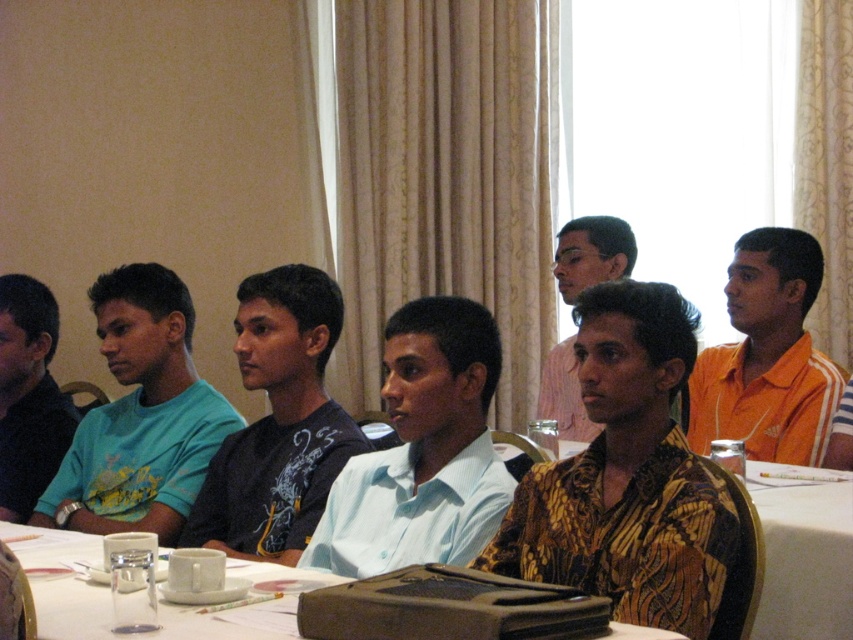
Can you confirm if printed fabric shirt at center is positioned above light blue shirt at center?

Incorrect, printed fabric shirt at center is not positioned above light blue shirt at center.

Does point (521, 529) come in front of point (381, 525)?

Yes, it is.

Locate an element on the screen. The height and width of the screenshot is (640, 853). printed fabric shirt at center is located at coordinates (627, 476).

Is point (151, 344) farther from camera compared to point (366, 451)?

Yes.

Measure the distance between matte blue shirt at left and camera.

A distance of 2.19 meters exists between matte blue shirt at left and camera.

What do you see at coordinates (140, 416) in the screenshot?
I see `matte blue shirt at left` at bounding box center [140, 416].

Locate an element on the screen. matte blue shirt at left is located at coordinates (140, 416).

Between matte blue shirt at left and white glossy table at center, which one has less height?

With less height is white glossy table at center.

The height and width of the screenshot is (640, 853). What do you see at coordinates (140, 416) in the screenshot?
I see `matte blue shirt at left` at bounding box center [140, 416].

Locate an element on the screen. The width and height of the screenshot is (853, 640). matte blue shirt at left is located at coordinates (140, 416).